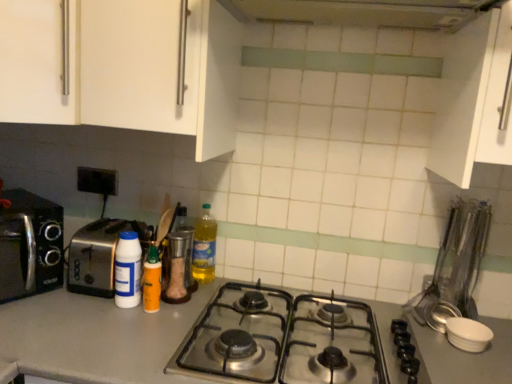
Identify the location of free location to the left of white matte bottle at center-left, which is the first bottle from left to right. (62, 303).